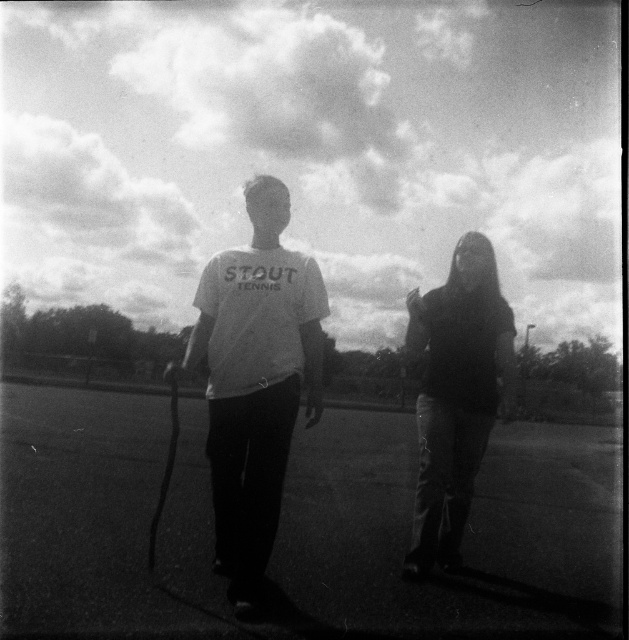
Question: Is white matte shirt at center to the left of dark fabric jacket at center from the viewer's perspective?

Choices:
 (A) no
 (B) yes

Answer: (B)

Question: Does white matte shirt at center have a greater width compared to dark fabric jacket at center?

Choices:
 (A) no
 (B) yes

Answer: (A)

Question: Does white matte shirt at center have a lesser width compared to dark fabric jacket at center?

Choices:
 (A) no
 (B) yes

Answer: (B)

Question: Among these objects, which one is farthest from the camera?

Choices:
 (A) dark fabric jacket at center
 (B) white matte shirt at center

Answer: (A)